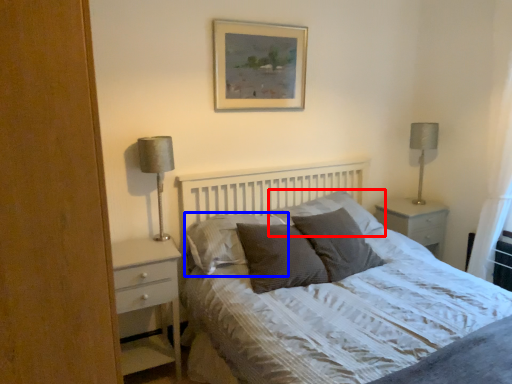
Question: Among these objects, which one is farthest to the camera, pillow (highlighted by a red box) or pillow (highlighted by a blue box)?

Choices:
 (A) pillow
 (B) pillow

Answer: (A)